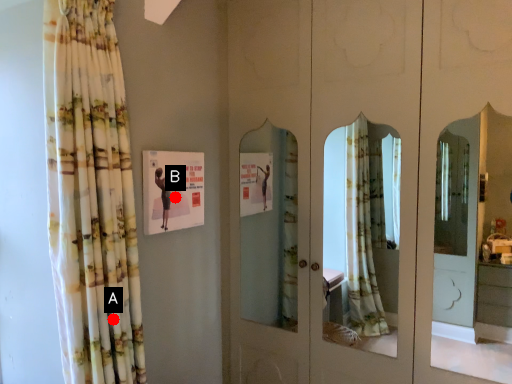
Question: Two points are circled on the image, labeled by A and B beside each circle. Which point is closer to the camera taking this photo?

Choices:
 (A) A is closer
 (B) B is closer

Answer: (A)